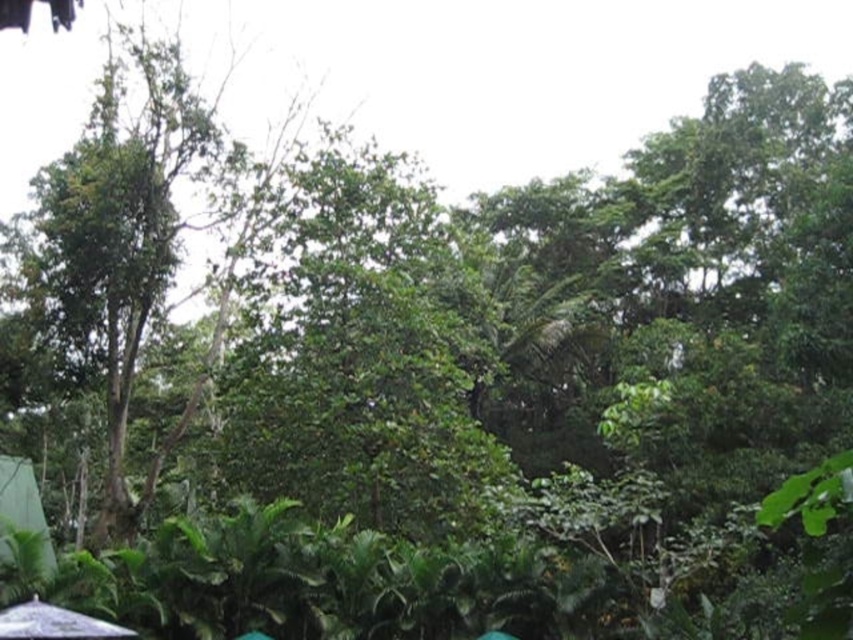
You are navigating through a dense tropical forest and come across two points marked in the scene. The first point is at coordinates point (51, 552) and the second is at point (38, 618). Which point is closer to you as you stand in the forest?

Point (51, 552) is closer to you than point (38, 618) because it is further to the viewer, meaning it is positioned nearer in the scene.

You are a hiker carrying a 3.5 meter long telescoping pole. You spot the green leafy canopy at lower left and the white matte umbrella at lower left in the forest. Can you fit the pole between them without bending it?

The distance between the green leafy canopy at lower left and white matte umbrella at lower left is 3.76 meters. Since the pole is 3.5 meters long, it can fit between them without bending.